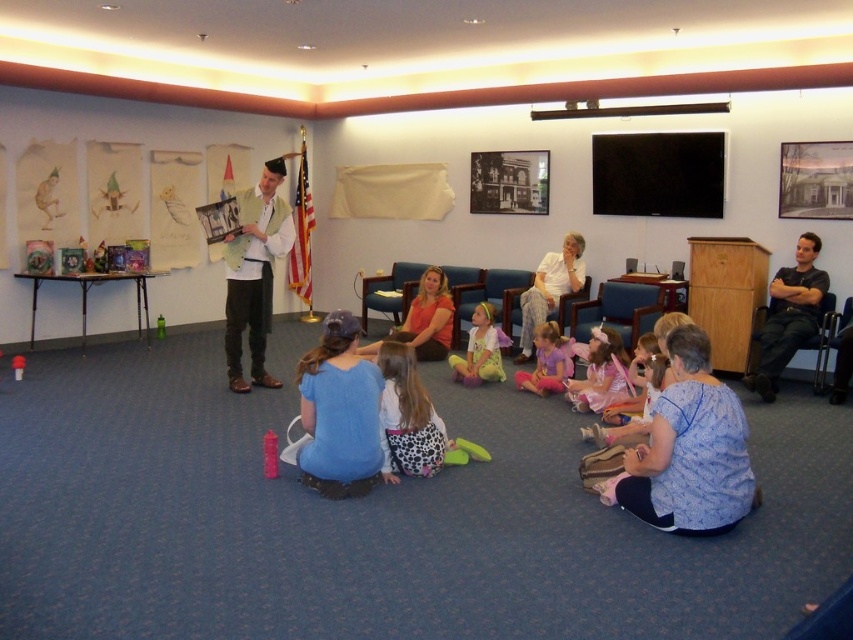
Question: Among these points, which one is nearest to the camera?

Choices:
 (A) (416, 433)
 (B) (583, 298)

Answer: (A)

Question: Which point is farther from the camera taking this photo?

Choices:
 (A) (512, 321)
 (B) (231, 333)
 (C) (474, 362)
 (D) (817, 314)

Answer: (A)

Question: Can you confirm if pastel pink fabric dress at center is positioned to the right of metallic gray chair at right?

Choices:
 (A) yes
 (B) no

Answer: (B)

Question: Does shiny pink dress at lower center lie behind light blue fabric chair at center?

Choices:
 (A) yes
 (B) no

Answer: (B)

Question: Can you confirm if shiny pink dress at lower center is smaller than light blue fabric chair at center?

Choices:
 (A) yes
 (B) no

Answer: (A)

Question: Considering the real-world distances, which object is closest to the blue fabric chair at center?

Choices:
 (A) pastel pink fabric dress at center
 (B) dotted fabric pants at center
 (C) metallic gray chair at right
 (D) purple satin dress at center

Answer: (D)